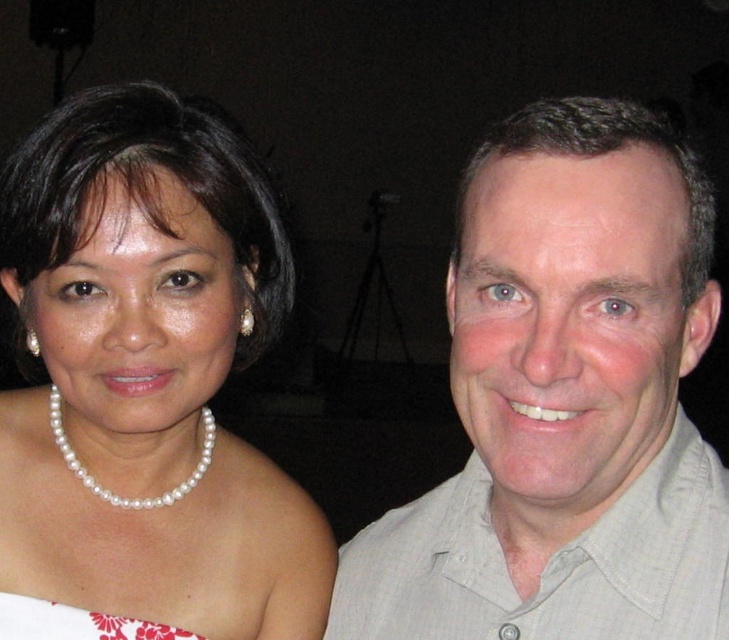
You are a photographer adjusting the lighting for a portrait. You notice the pearl necklace at center and the white floral fabric dress at lower left. Which object is positioned higher in the image?

The pearl necklace at center is positioned higher than the white floral fabric dress at lower left.

You are a photographer setting up for a portrait. You have a 30 cm wide backdrop that needs to be placed between the light beige shirt at right and the white floral fabric dress at lower left. Will the backdrop fit between them?

The light beige shirt at right and white floral fabric dress at lower left are 32.89 centimeters apart. Since the backdrop is 30 cm wide, it can fit between them with some space remaining.

You are taking a photo of two people standing in front of you. You notice two points in the scene labeled as point (183, 218) and point (109, 616). Which point is nearer to your camera?

Point (183, 218) is closer to the camera than point (109, 616).